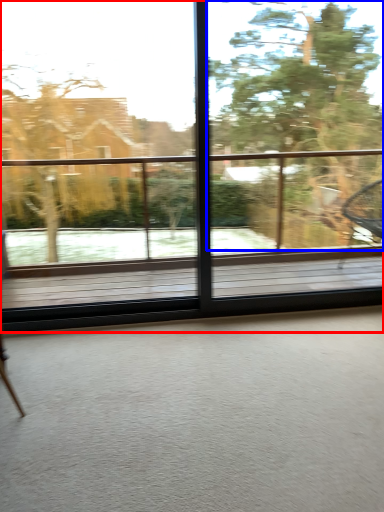
Question: Which point is further to the camera, window (highlighted by a red box) or tree (highlighted by a blue box)?

Choices:
 (A) window
 (B) tree

Answer: (B)